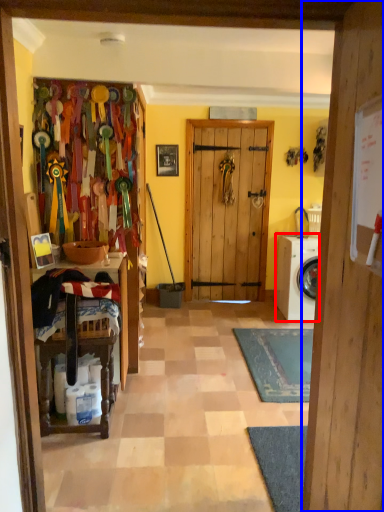
Question: Which object appears closest to the camera in this image, washing machine (highlighted by a red box) or door (highlighted by a blue box)?

Choices:
 (A) washing machine
 (B) door

Answer: (B)